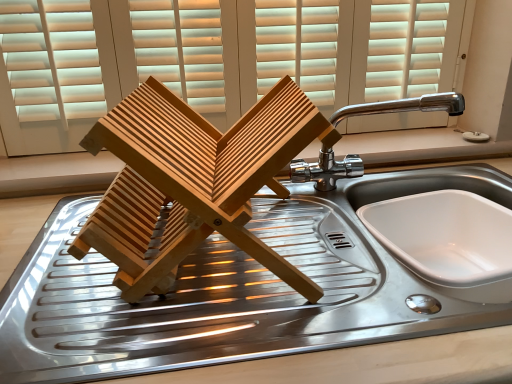
Question: Is white glossy sink at lower right surrounding wooden blinds at upper center?

Choices:
 (A) yes
 (B) no

Answer: (B)

Question: Does white glossy sink at lower right have a lesser width compared to wooden blinds at upper center?

Choices:
 (A) yes
 (B) no

Answer: (B)

Question: Is there a large distance between white glossy sink at lower right and wooden blinds at upper center?

Choices:
 (A) no
 (B) yes

Answer: (A)

Question: Can you confirm if white glossy sink at lower right is smaller than wooden blinds at upper center?

Choices:
 (A) yes
 (B) no

Answer: (A)

Question: Does white glossy sink at lower right have a larger size compared to wooden blinds at upper center?

Choices:
 (A) yes
 (B) no

Answer: (B)

Question: From the image's perspective, would you say white glossy sink at lower right is shown under wooden blinds at upper center?

Choices:
 (A) yes
 (B) no

Answer: (A)

Question: Is chrome metallic faucet at upper right taller than wooden blinds at upper center?

Choices:
 (A) no
 (B) yes

Answer: (A)

Question: Is wooden blinds at upper center a part of chrome metallic faucet at upper right?

Choices:
 (A) yes
 (B) no

Answer: (B)

Question: Can you confirm if chrome metallic faucet at upper right is wider than wooden blinds at upper center?

Choices:
 (A) no
 (B) yes

Answer: (B)

Question: Considering the relative sizes of chrome metallic faucet at upper right and wooden blinds at upper center in the image provided, is chrome metallic faucet at upper right smaller than wooden blinds at upper center?

Choices:
 (A) yes
 (B) no

Answer: (A)

Question: Does chrome metallic faucet at upper right appear on the right side of wooden blinds at upper center?

Choices:
 (A) no
 (B) yes

Answer: (B)

Question: From a real-world perspective, is chrome metallic faucet at upper right physically above wooden blinds at upper center?

Choices:
 (A) no
 (B) yes

Answer: (A)

Question: Does wooden blinds at upper center have a greater height compared to white glossy sink at lower right?

Choices:
 (A) yes
 (B) no

Answer: (A)